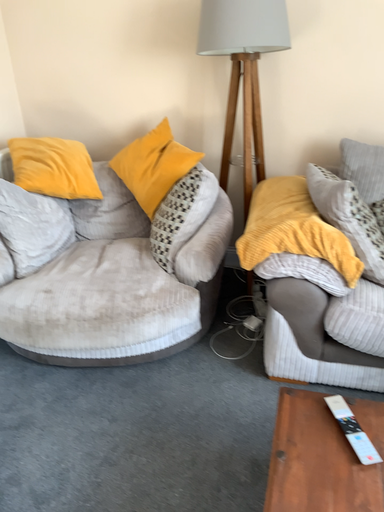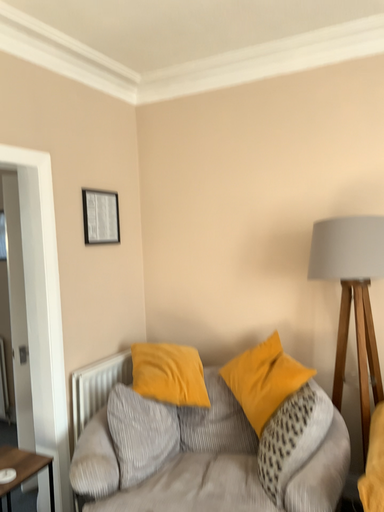
Question: How did the camera likely rotate when shooting the video?

Choices:
 (A) rotated right
 (B) rotated left

Answer: (B)